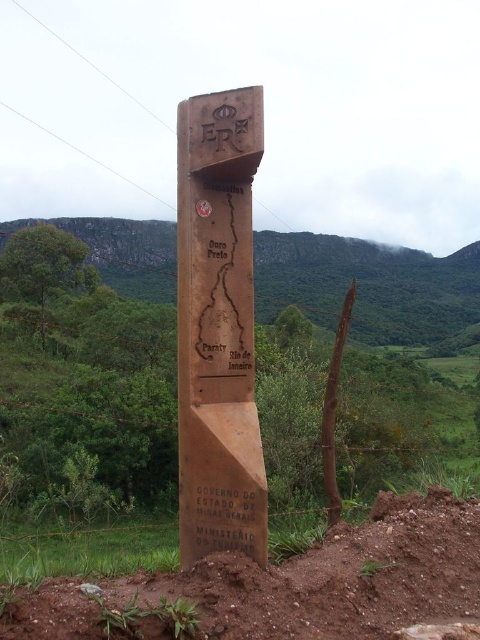
Consider the image. Between wooden signpost at center and black matte text at lower center, which one appears on the left side from the viewer's perspective?

From the viewer's perspective, wooden signpost at center appears more on the left side.

Does point (243, 497) come behind point (219, 545)?

That is False.

Between point (215, 168) and point (264, 502), which one is positioned behind?

Positioned behind is point (215, 168).

Find the location of `wooden signpost at center`. wooden signpost at center is located at coordinates (217, 326).

Can you confirm if wooden signpost at center is bigger than brown wooden signpost at center?

Actually, wooden signpost at center might be smaller than brown wooden signpost at center.

Based on the photo, is wooden signpost at center wider than brown wooden signpost at center?

Incorrect, wooden signpost at center's width does not surpass brown wooden signpost at center's.

Where is `wooden signpost at center`? wooden signpost at center is located at coordinates (217, 326).

Identify the location of wooden signpost at center. (217, 326).

Is brown soil at lower center above black matte text at lower center?

No.

In the scene shown: Who is more distant from viewer, (162, 604) or (250, 545)?

The point (250, 545) is behind.

Locate an element on the screen. brown soil at lower center is located at coordinates (284, 586).